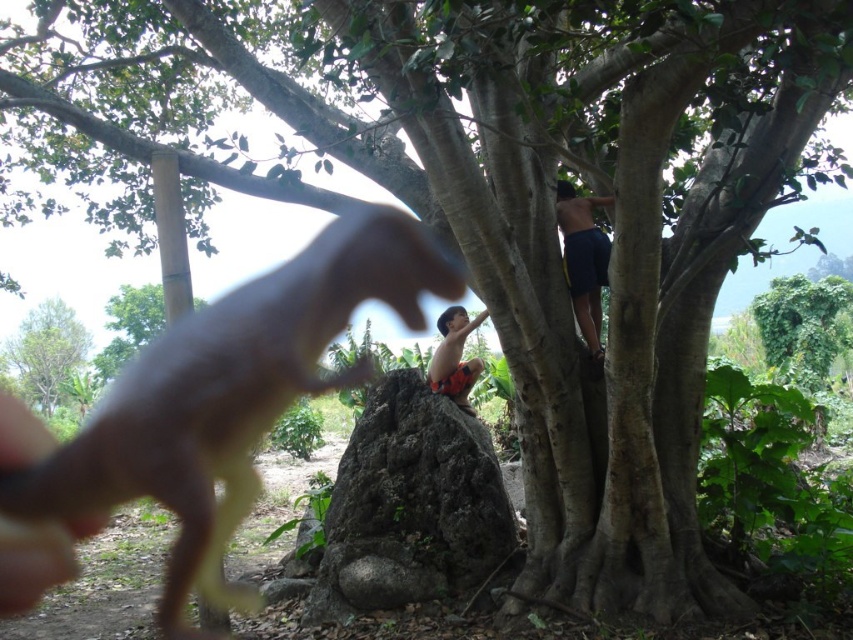
You are standing in the outdoor scene and see a point marked at coordinates (229, 387). What object is located at that point?

The point at coordinates (229, 387) corresponds to the brown matte dinosaur at left.

You are standing in the natural outdoor setting shown in the image. You see the green leafy tree at upper left. Can you determine its exact location in terms of coordinates?

The green leafy tree at upper left is located at point [47,353].